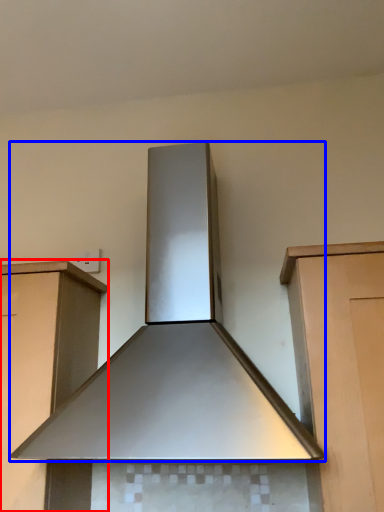
Question: Which point is further to the camera, cabinetry (highlighted by a red box) or home appliance (highlighted by a blue box)?

Choices:
 (A) cabinetry
 (B) home appliance

Answer: (A)